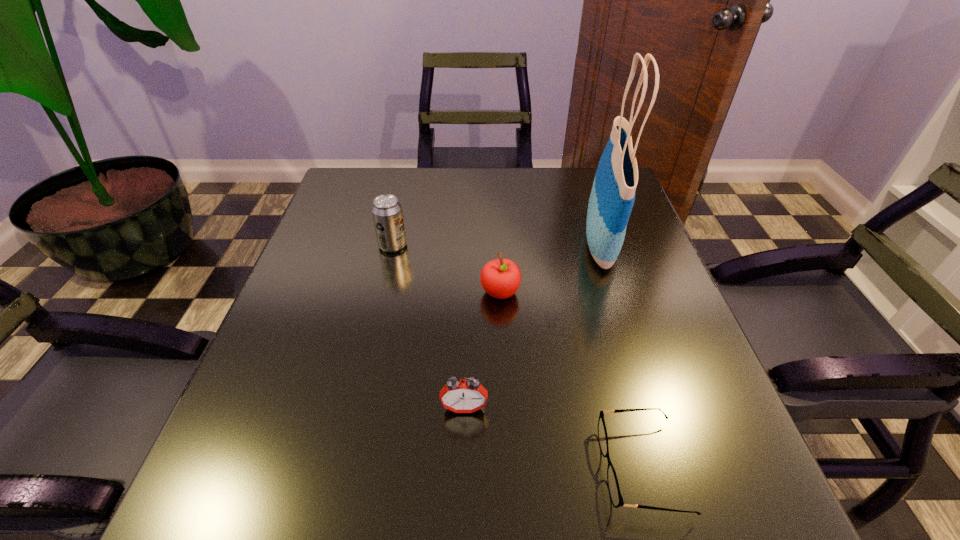
The height and width of the screenshot is (540, 960). I want to click on free region at the far edge, so click(523, 196).

Find the location of a particular element. The height and width of the screenshot is (540, 960). vacant space at the left edge of the desktop is located at coordinates (229, 435).

The width and height of the screenshot is (960, 540). In the image, there is a desktop. In order to click on vacant space at the right edge in this screenshot , I will do `click(630, 224)`.

Identify the location of vacant position at the near right corner of the desktop. (701, 501).

I want to click on vacant area that lies between the alarm clock and the spectacles, so click(553, 438).

Locate an element on the screen. free space between the nearest object and the tote bag is located at coordinates (621, 355).

You are a GUI agent. You are given a task and a screenshot of the screen. Output one action in this format:
    pyautogui.click(x=<x>, y=<y>)
    Task: Click on the free space between the beer can and the second nearest object
    The image size is (960, 540).
    Given the screenshot: What is the action you would take?
    pyautogui.click(x=428, y=327)

You are a GUI agent. You are given a task and a screenshot of the screen. Output one action in this format:
    pyautogui.click(x=<x>, y=<y>)
    Task: Click on the free spot between the apple and the leftmost object
    
    Given the screenshot: What is the action you would take?
    pyautogui.click(x=446, y=269)

The image size is (960, 540). I want to click on vacant space that's between the fourth farthest object and the spectacles, so click(x=553, y=438).

I want to click on unoccupied position between the second tallest object and the shortest object, so click(517, 356).